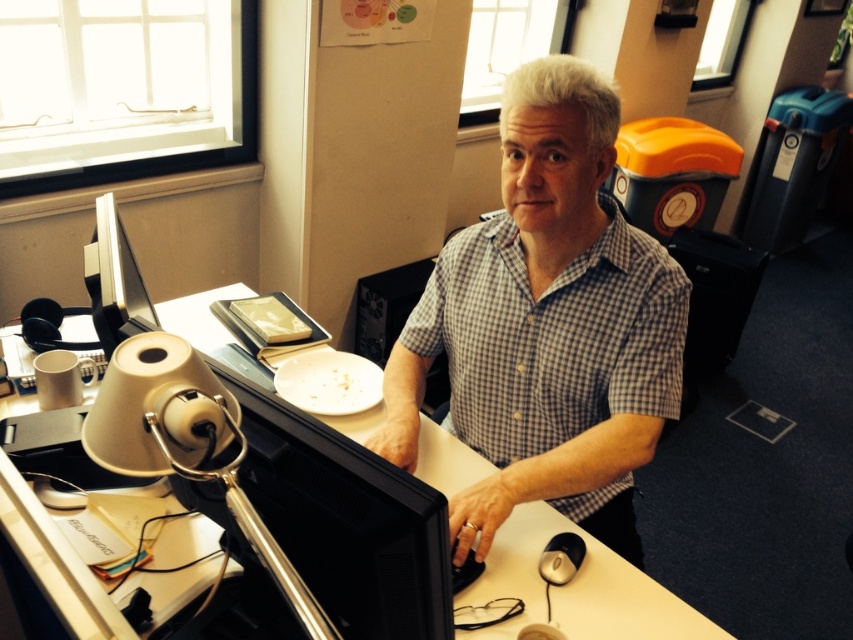
Can you confirm if checkered fabric shirt at center is thinner than satin black monitor at left?

Incorrect, checkered fabric shirt at center's width is not less than satin black monitor at left's.

Between checkered fabric shirt at center and satin black monitor at left, which one is positioned higher?

satin black monitor at left is above.

Image resolution: width=853 pixels, height=640 pixels. I want to click on checkered fabric shirt at center, so click(547, 324).

Where is `checkered fabric shirt at center`? This screenshot has height=640, width=853. checkered fabric shirt at center is located at coordinates (547, 324).

Does white plastic table at center lie in front of satin black monitor at left?

No, it is not.

Does white plastic table at center have a lesser height compared to satin black monitor at left?

Yes.

Who is more distant from viewer, (204, 531) or (109, 237)?

The point (109, 237) is behind.

Identify the location of white plastic table at center. (578, 589).

Who is more forward, (550,381) or (496,545)?

Point (496,545) is in front.

The image size is (853, 640). In order to click on checkered fabric shirt at center in this screenshot , I will do `click(547, 324)`.